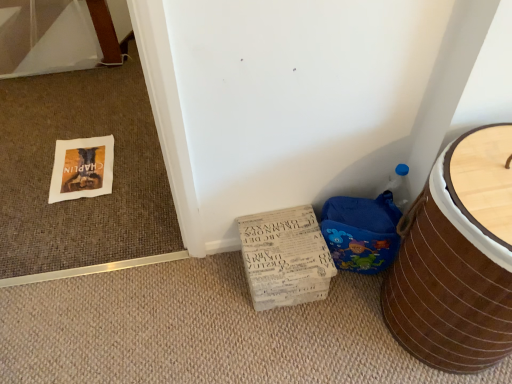
Question: Is blue fabric potty at lower right oriented away from white cardboard box at lower center?

Choices:
 (A) no
 (B) yes

Answer: (A)

Question: Is blue fabric potty at lower right shorter than white cardboard box at lower center?

Choices:
 (A) yes
 (B) no

Answer: (B)

Question: Is blue fabric potty at lower right to the left of white cardboard box at lower center from the viewer's perspective?

Choices:
 (A) yes
 (B) no

Answer: (B)

Question: Does blue fabric potty at lower right appear on the right side of white cardboard box at lower center?

Choices:
 (A) no
 (B) yes

Answer: (B)

Question: From a real-world perspective, is blue fabric potty at lower right under white cardboard box at lower center?

Choices:
 (A) no
 (B) yes

Answer: (A)

Question: From a real-world perspective, relative to blue fabric potty at lower right, is white cardboard box at lower center vertically above or below?

Choices:
 (A) above
 (B) below

Answer: (B)

Question: From the image's perspective, relative to blue fabric potty at lower right, is white cardboard box at lower center above or below?

Choices:
 (A) above
 (B) below

Answer: (B)

Question: From their relative heights in the image, would you say white cardboard box at lower center is taller or shorter than blue fabric potty at lower right?

Choices:
 (A) short
 (B) tall

Answer: (A)

Question: Would you say white cardboard box at lower center is to the left or to the right of blue fabric potty at lower right in the picture?

Choices:
 (A) right
 (B) left

Answer: (B)

Question: From a real-world perspective, is brown woven basket at lower right positioned above or below white cardboard box at lower center?

Choices:
 (A) below
 (B) above

Answer: (B)

Question: Relative to white cardboard box at lower center, is brown woven basket at lower right in front or behind?

Choices:
 (A) behind
 (B) front

Answer: (B)

Question: Does point coord(480,235) appear closer or farther from the camera than point coord(318,251)?

Choices:
 (A) farther
 (B) closer

Answer: (B)

Question: In terms of width, does brown woven basket at lower right look wider or thinner when compared to white cardboard box at lower center?

Choices:
 (A) thin
 (B) wide

Answer: (B)

Question: Considering the positions of blue fabric potty at lower right and white cardboard box at lower center in the image, is blue fabric potty at lower right bigger or smaller than white cardboard box at lower center?

Choices:
 (A) small
 (B) big

Answer: (A)

Question: In the image, is blue fabric potty at lower right positioned in front of or behind white cardboard box at lower center?

Choices:
 (A) front
 (B) behind

Answer: (A)